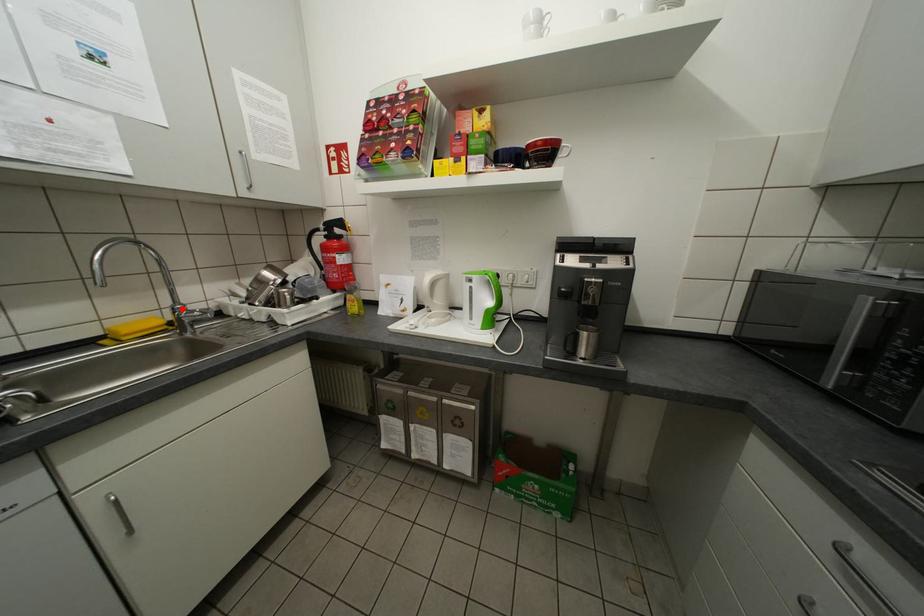
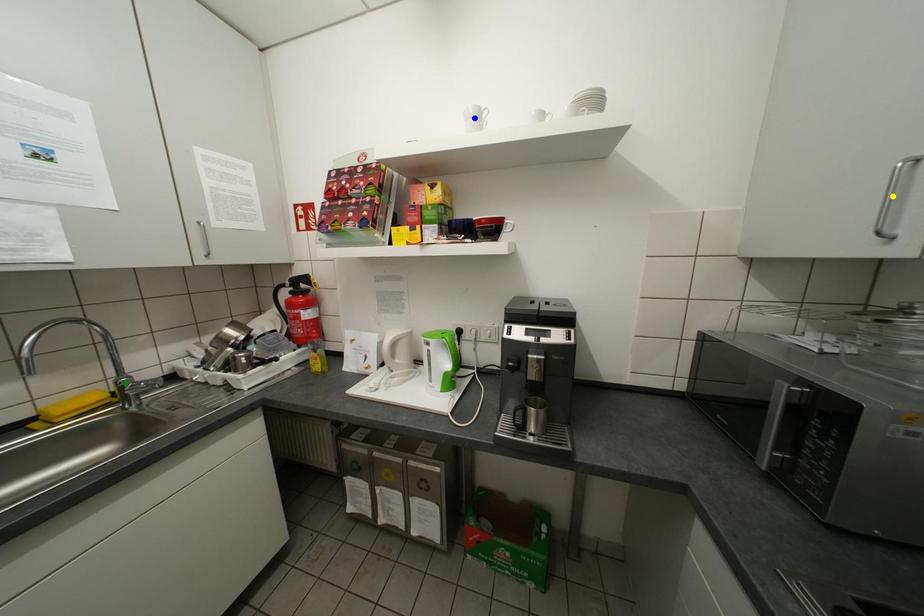
Question: I am providing you with two images of the same scene from different viewpoints. A red point is marked on the first image. You are given multiple points on the second image. In image 2, which mark is for the same physical point as the one in image 1?

Choices:
 (A) blue point
 (B) yellow point
 (C) green point

Answer: (C)